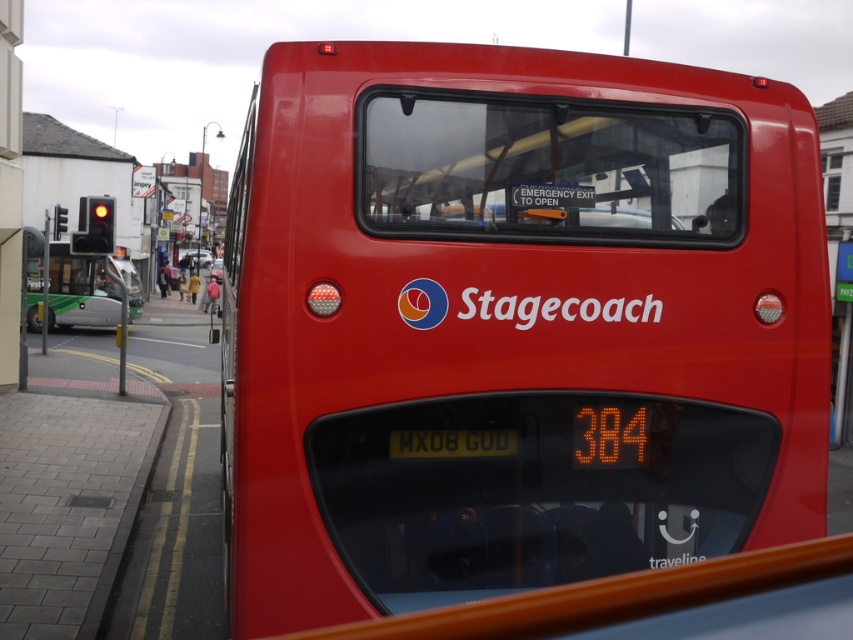
Question: Does shiny red bus at center appear on the right side of yellow metallic license plate at center?

Choices:
 (A) yes
 (B) no

Answer: (A)

Question: Based on their relative distances, which object is farther from the green metallic bus at left?

Choices:
 (A) shiny red bus at center
 (B) yellow metallic license plate at center

Answer: (B)

Question: Which point appears closest to the camera in this image?

Choices:
 (A) (450, 433)
 (B) (663, 413)
 (C) (71, 268)

Answer: (A)

Question: Can you confirm if shiny red bus at center is wider than green metallic bus at left?

Choices:
 (A) yes
 (B) no

Answer: (A)

Question: Is shiny red bus at center thinner than yellow metallic license plate at center?

Choices:
 (A) yes
 (B) no

Answer: (B)

Question: Which of the following is the farthest from the observer?

Choices:
 (A) green metallic bus at left
 (B) shiny red bus at center

Answer: (A)